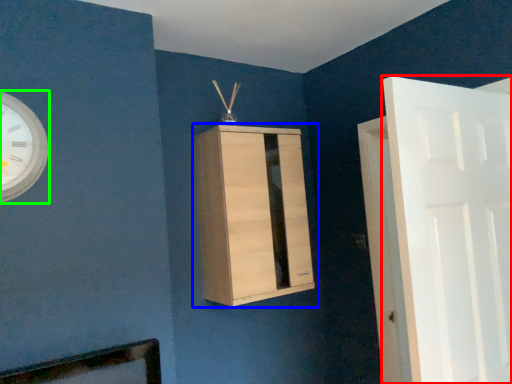
Question: Which is nearer to the door (highlighted by a red box)? cupboard (highlighted by a blue box) or wall clock (highlighted by a green box).

Choices:
 (A) cupboard
 (B) wall clock

Answer: (A)